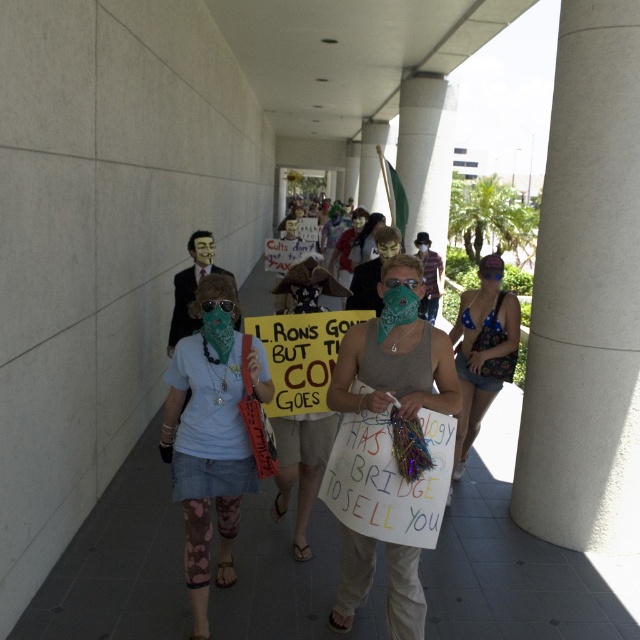
Question: Which point appears closest to the camera in this image?

Choices:
 (A) (352, 371)
 (B) (497, 282)
 (C) (186, 529)

Answer: (A)

Question: Which of the following is the farthest from the observer?

Choices:
 (A) (467, 385)
 (B) (435, 384)
 (C) (198, 435)

Answer: (A)

Question: Is green bandana at center closer to camera compared to blue bikini top at right?

Choices:
 (A) no
 (B) yes

Answer: (B)

Question: Among these points, which one is nearest to the camera?

Choices:
 (A) (172, 458)
 (B) (397, 369)

Answer: (B)

Question: Does green bandana at center appear under blue bikini top at right?

Choices:
 (A) yes
 (B) no

Answer: (B)

Question: Can you confirm if light blue t-shirt at center is thinner than green bandana at center?

Choices:
 (A) no
 (B) yes

Answer: (A)